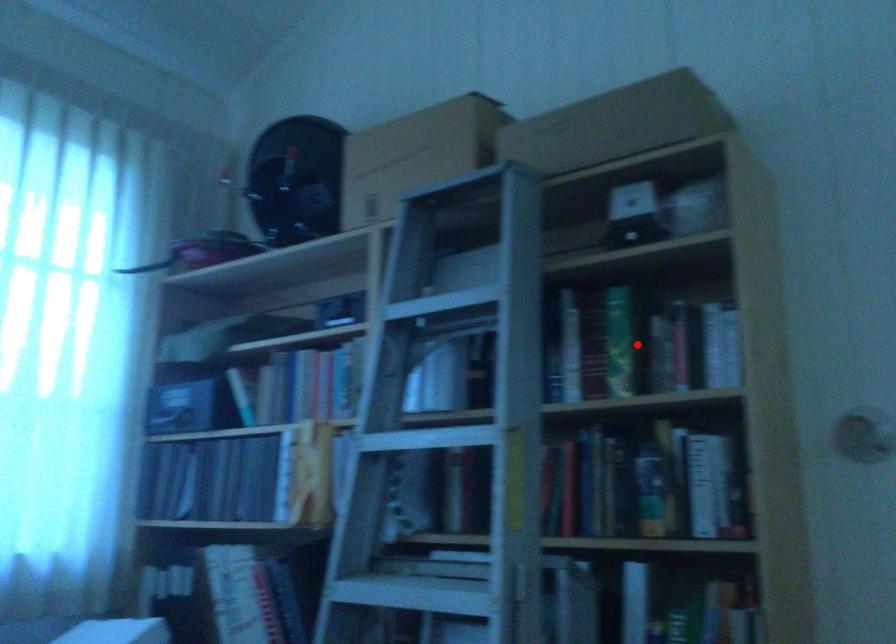
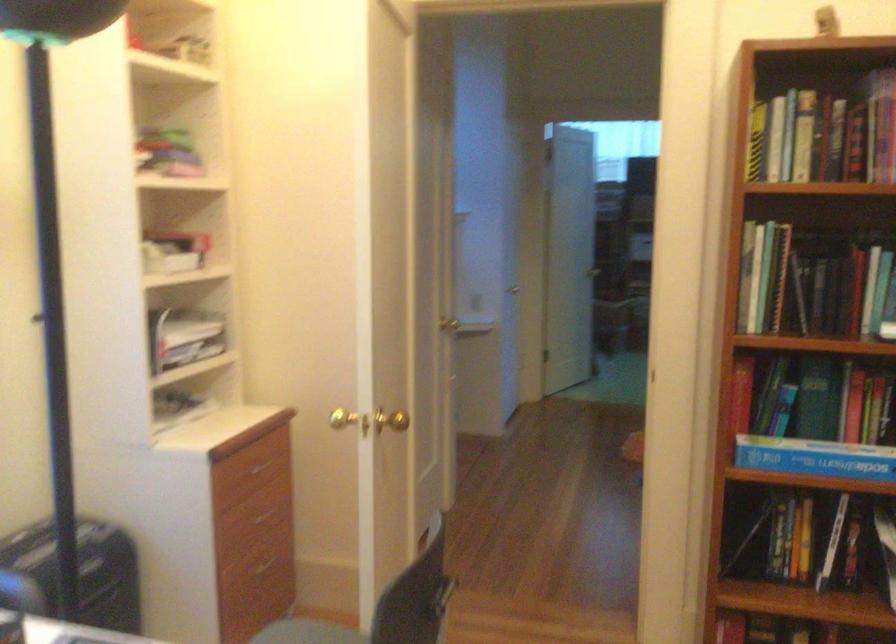
Question: I am providing you with two images of the same scene from different viewpoints. A red point is marked on the first image. Is the red point's position out of view in image 2?

Choices:
 (A) Yes
 (B) No

Answer: (A)